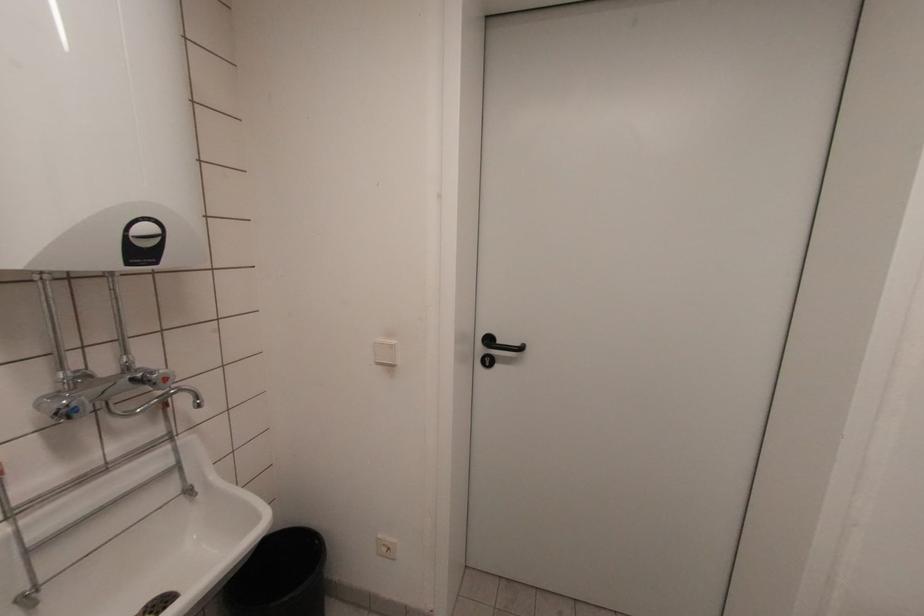
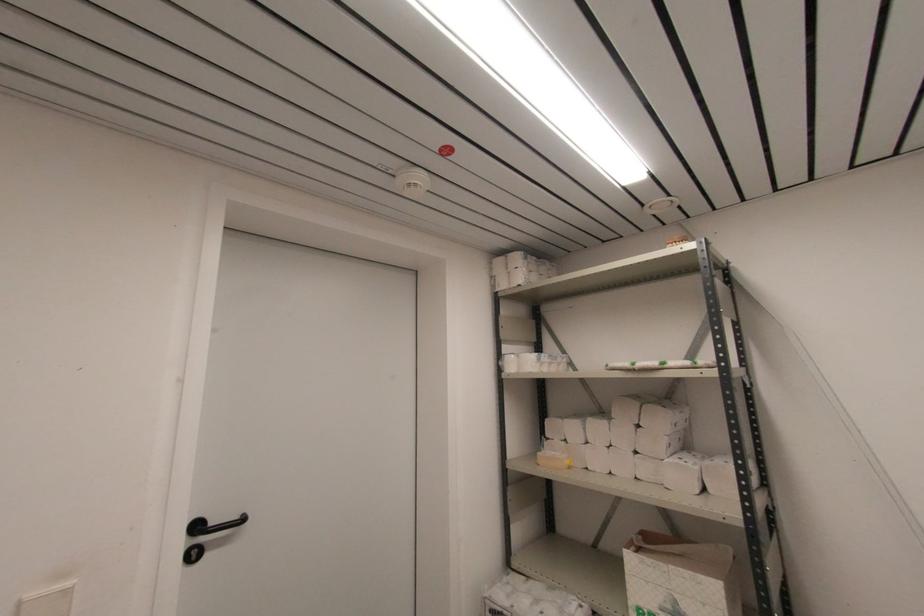
Question: The first image is from the beginning of the video and the second image is from the end. How did the camera likely rotate when shooting the video?

Choices:
 (A) Left
 (B) Right
 (C) Up
 (D) Down

Answer: (B)